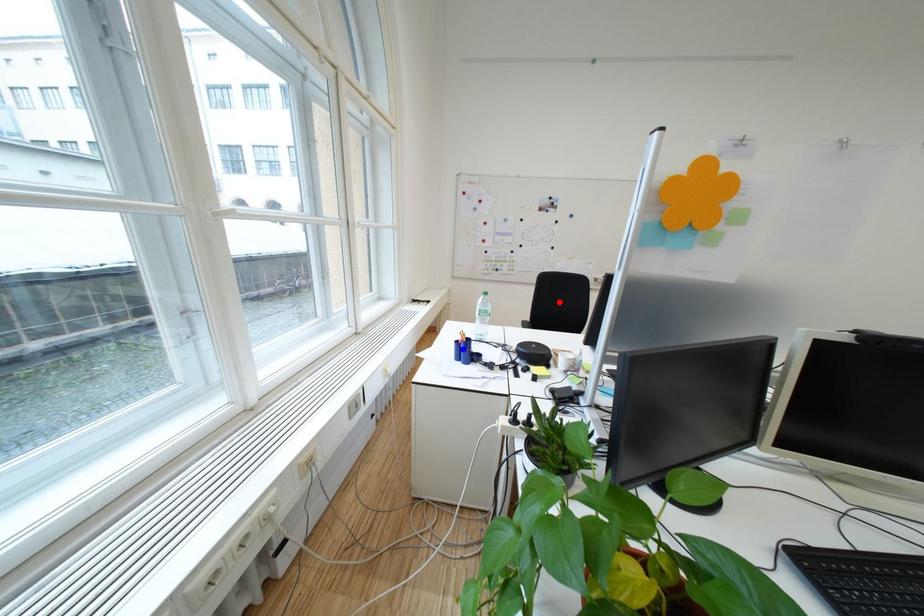
Question: Two points are marked on the image. Which point is closer to the camera?

Choices:
 (A) Blue point is closer.
 (B) Red point is closer.

Answer: (A)